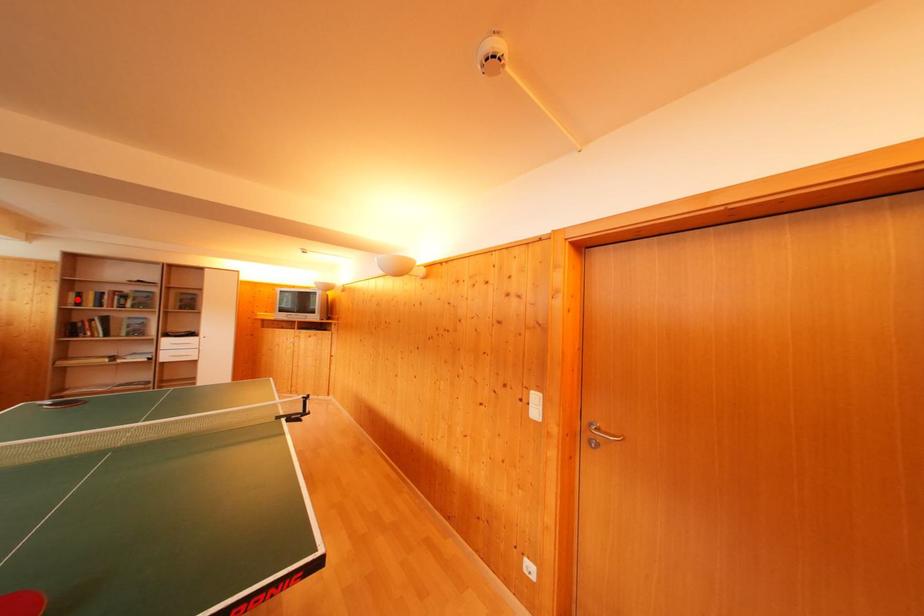
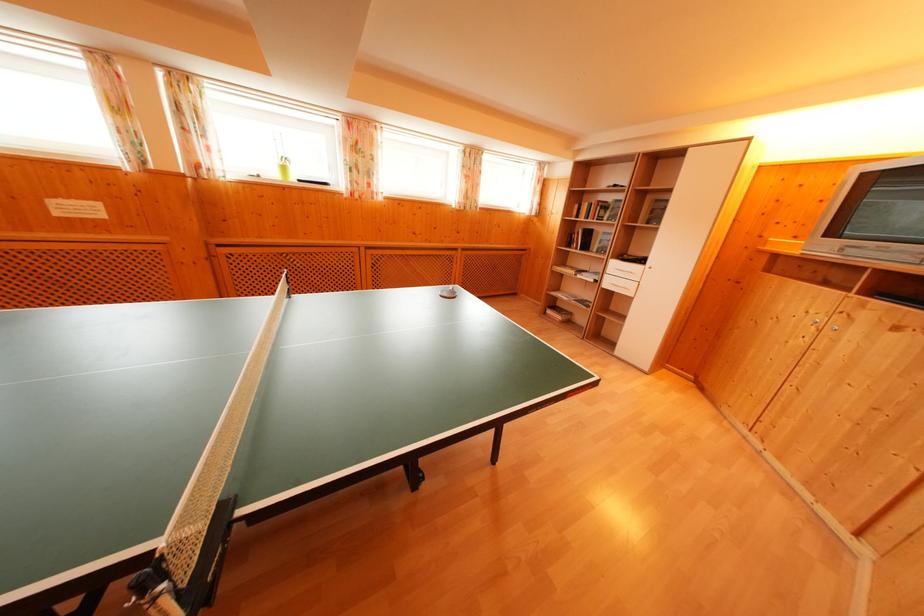
Question: I am providing you with two images of the same scene from different viewpoints. A red point is shown in image1. For the corresponding object point in image2, is it positioned nearer or farther from the camera?

Choices:
 (A) Nearer
 (B) Farther

Answer: (A)